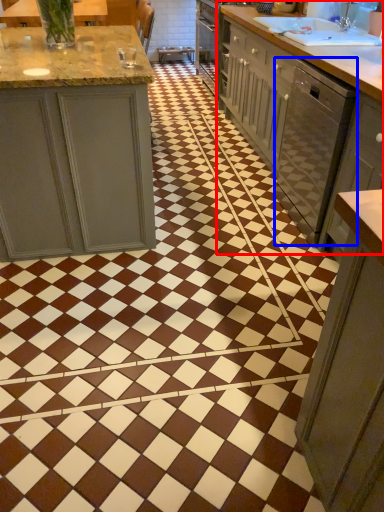
Question: Which of the following is the farthest to the observer, countertop (highlighted by a red box) or dish washer (highlighted by a blue box)?

Choices:
 (A) countertop
 (B) dish washer

Answer: (A)